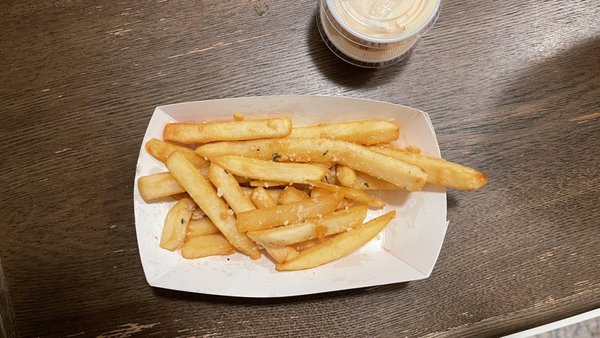
Locate an element on the screen. edge of table is located at coordinates (525, 318).